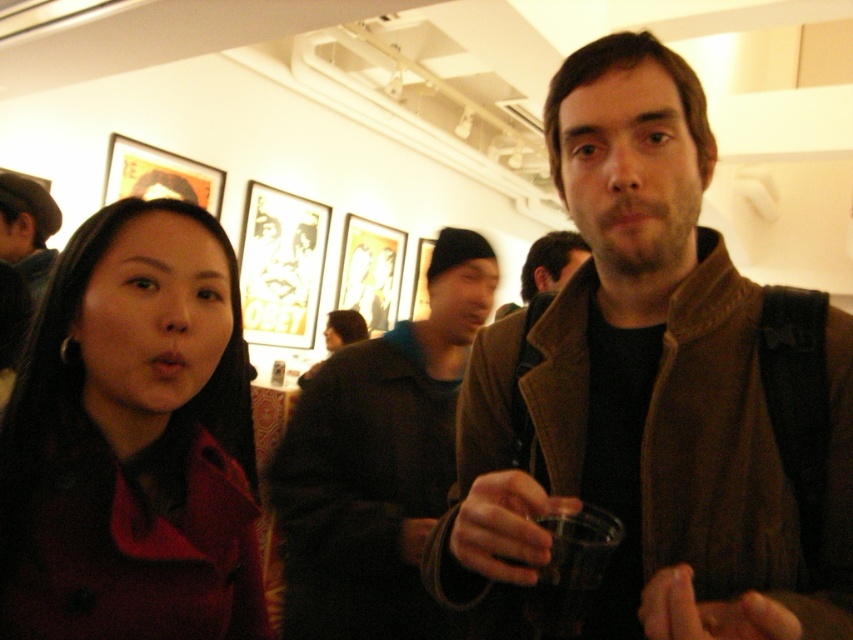
Is the position of dark brown woolen jacket at center less distant than that of transparent plastic cup at center?

No, it is not.

Can you confirm if dark brown woolen jacket at center is smaller than transparent plastic cup at center?

Actually, dark brown woolen jacket at center might be larger than transparent plastic cup at center.

Does point (392, 333) lie in front of point (583, 524)?

No.

Locate an element on the screen. This screenshot has width=853, height=640. dark brown woolen jacket at center is located at coordinates (376, 461).

Is point (10, 540) positioned after point (351, 593)?

No, it is in front of (351, 593).

Is matte red coat at left closer to camera compared to dark brown woolen jacket at center?

That is True.

Find the location of a particular element. The height and width of the screenshot is (640, 853). matte red coat at left is located at coordinates (132, 442).

Who is more distant from viewer, (485,330) or (383,420)?

Positioned behind is point (383,420).

Does brown leather jacket at center appear under dark brown woolen jacket at center?

No.

I want to click on brown leather jacket at center, so click(653, 396).